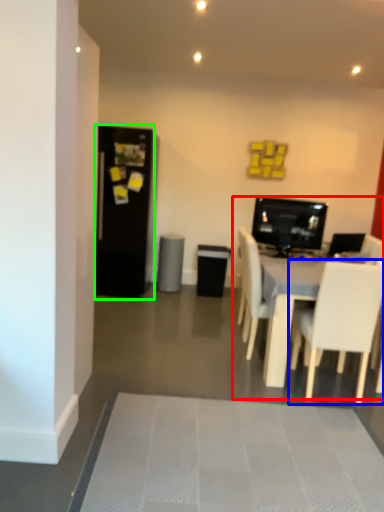
Question: Which is nearer to the entertainment center (highlighted by a red box)? chair (highlighted by a blue box) or fridge (highlighted by a green box).

Choices:
 (A) chair
 (B) fridge

Answer: (A)